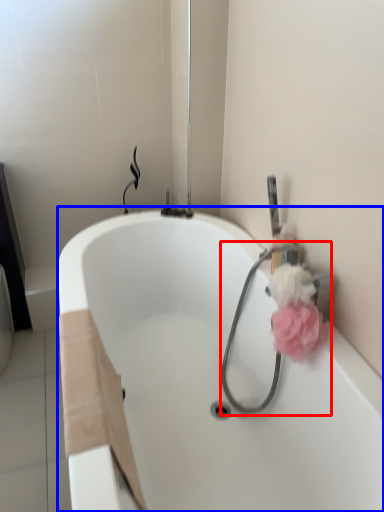
Question: Which object is further to the camera taking this photo, garden hose (highlighted by a red box) or bathtub (highlighted by a blue box)?

Choices:
 (A) garden hose
 (B) bathtub

Answer: (A)